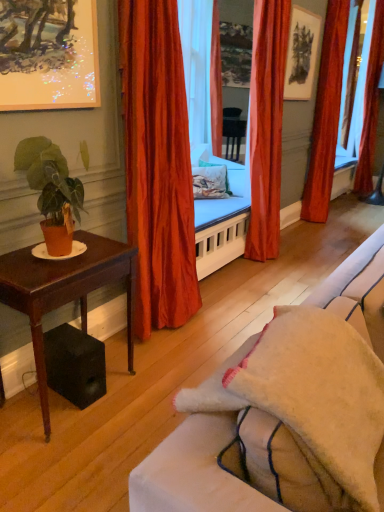
Question: Does transparent glass window screen at right have a smaller size compared to floral fabric pillow at center?

Choices:
 (A) yes
 (B) no

Answer: (B)

Question: From the image's perspective, is transparent glass window screen at right below floral fabric pillow at center?

Choices:
 (A) yes
 (B) no

Answer: (B)

Question: Is transparent glass window screen at right further to camera compared to floral fabric pillow at center?

Choices:
 (A) no
 (B) yes

Answer: (B)

Question: Is transparent glass window screen at right far from floral fabric pillow at center?

Choices:
 (A) no
 (B) yes

Answer: (B)

Question: Is transparent glass window screen at right bigger than floral fabric pillow at center?

Choices:
 (A) yes
 (B) no

Answer: (A)

Question: From a real-world perspective, is satin orange curtain at center, the fourth curtain positioned from the back, above or below matte black picture frame at upper center, which is the 2th picture frame from bottom to top?

Choices:
 (A) below
 (B) above

Answer: (A)

Question: Based on their positions, is satin orange curtain at center, acting as the fourth curtain starting from the right, located to the left or right of matte black picture frame at upper center, the first picture frame viewed from the top?

Choices:
 (A) left
 (B) right

Answer: (A)

Question: Based on their sizes in the image, would you say satin orange curtain at center, positioned as the 1th curtain in front-to-back order, is bigger or smaller than matte black picture frame at upper center, the first picture frame viewed from the top?

Choices:
 (A) small
 (B) big

Answer: (B)

Question: From their relative heights in the image, would you say satin orange curtain at center, which is counted as the 1th curtain, starting from the left, is taller or shorter than matte black picture frame at upper center, the second picture frame positioned from the front?

Choices:
 (A) tall
 (B) short

Answer: (A)

Question: In terms of height, does velvet orange curtain at center, placed as the second curtain when sorted from front to back, look taller or shorter compared to velvet orange curtain at right, the fourth curtain when ordered from left to right?

Choices:
 (A) short
 (B) tall

Answer: (B)

Question: Considering the positions of velvet orange curtain at center, placed as the second curtain when sorted from front to back, and velvet orange curtain at right, acting as the 1th curtain starting from the right, in the image, is velvet orange curtain at center, placed as the second curtain when sorted from front to back, wider or thinner than velvet orange curtain at right, acting as the 1th curtain starting from the right,?

Choices:
 (A) thin
 (B) wide

Answer: (A)

Question: Is velvet orange curtain at center, which ranks as the 3th curtain in back-to-front order, bigger or smaller than velvet orange curtain at right, which is the fourth curtain from front to back?

Choices:
 (A) big
 (B) small

Answer: (A)

Question: In the image, is velvet orange curtain at center, which ranks as the 3th curtain in back-to-front order, on the left side or the right side of velvet orange curtain at right, the fourth curtain when ordered from left to right?

Choices:
 (A) right
 (B) left

Answer: (B)

Question: From their relative heights in the image, would you say velvet orange curtain at center, the third curtain from the right, is taller or shorter than matte orange pot at left?

Choices:
 (A) short
 (B) tall

Answer: (B)

Question: Is point (269, 230) closer or farther from the camera than point (77, 195)?

Choices:
 (A) closer
 (B) farther

Answer: (B)